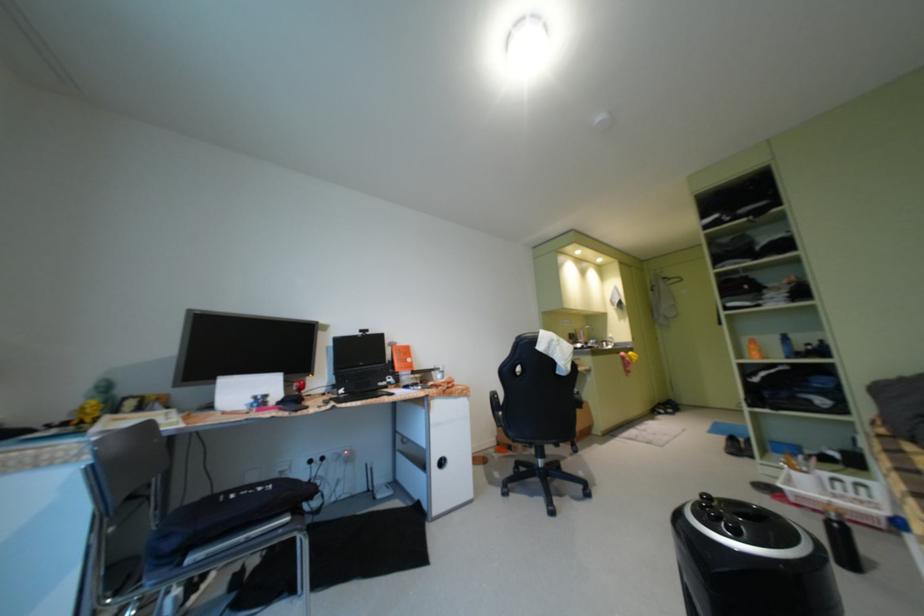
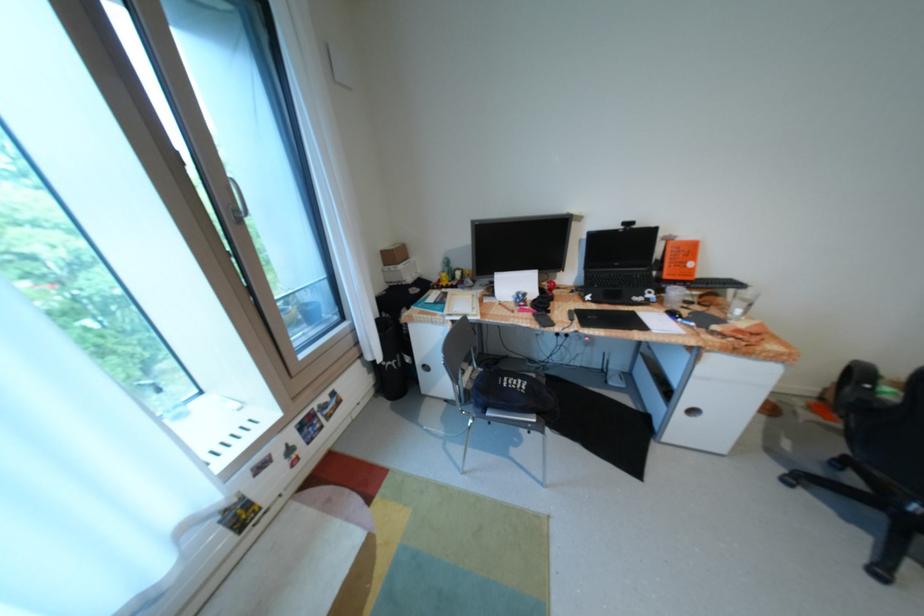
Locate, in the second image, the point that corresponds to pixel 417 361 in the first image.

(697, 264)